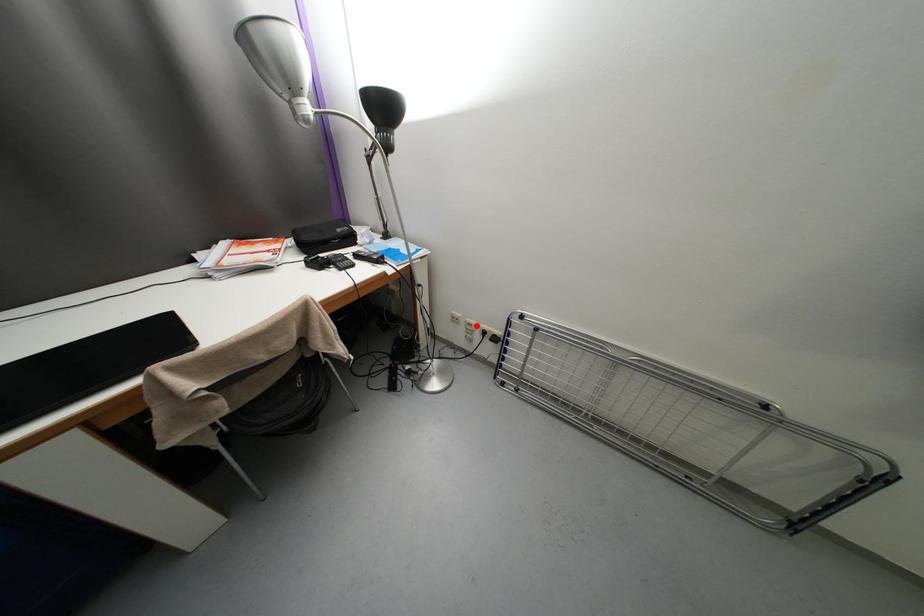
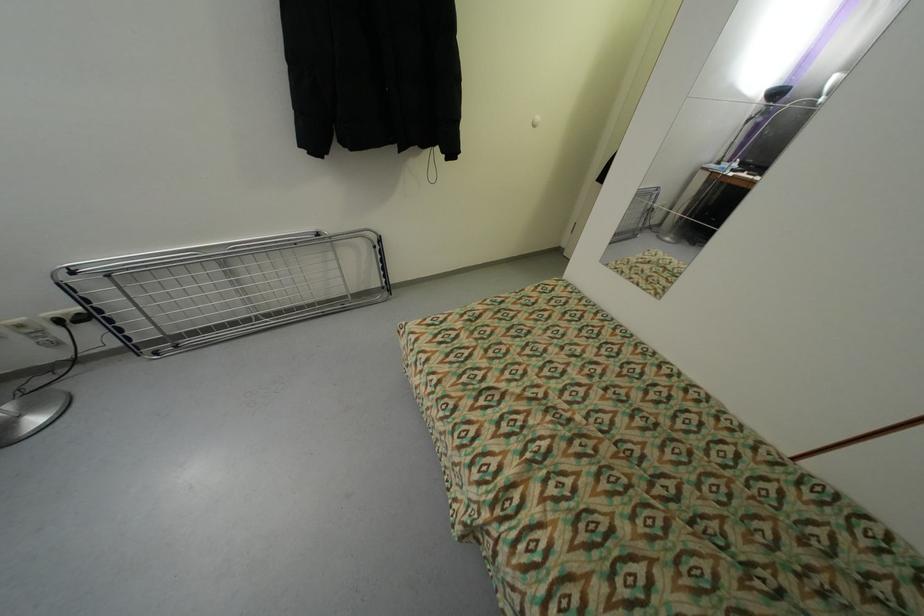
Question: I am providing you with two images of the same scene from different viewpoints. Given a red point in image1, look at the same physical point in image2. Is it:

Choices:
 (A) Closer to the viewpoint
 (B) Farther from the viewpoint

Answer: (B)